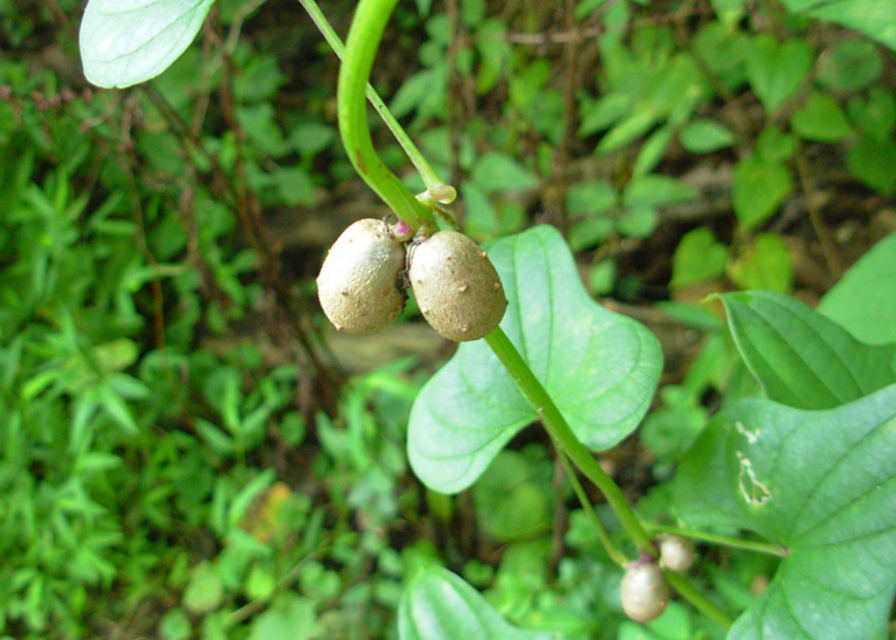
You are a botanist examining the plant. You notice a point marked at coordinates [363,276]. Based on the plant structure described, what does this point most likely represent?

The point at coordinates [363,276] corresponds to the smooth beige pod at center, which is one of the fruit structures encased in green pods on the plant stem.